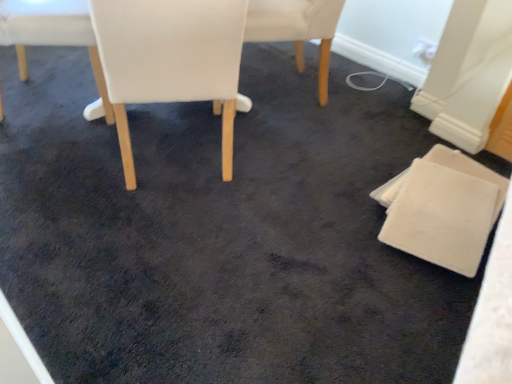
Question: Considering the relative sizes of white leather chair at center, marked as the 2th chair in a right-to-left arrangement, and white leather chair at center, the 2th chair viewed from the left, in the image provided, is white leather chair at center, marked as the 2th chair in a right-to-left arrangement, smaller than white leather chair at center, the 2th chair viewed from the left,?

Choices:
 (A) yes
 (B) no

Answer: (A)

Question: Is white leather chair at center, marked as the 2th chair in a right-to-left arrangement, surrounding white leather chair at center, the 2th chair viewed from the left?

Choices:
 (A) yes
 (B) no

Answer: (B)

Question: Is white leather chair at center, marked as the 2th chair in a right-to-left arrangement, at the right side of white leather chair at center, the 2th chair viewed from the left?

Choices:
 (A) no
 (B) yes

Answer: (B)

Question: Considering the relative sizes of white leather chair at center, marked as the 2th chair in a right-to-left arrangement, and white leather chair at center, the 2th chair viewed from the left, in the image provided, is white leather chair at center, marked as the 2th chair in a right-to-left arrangement, thinner than white leather chair at center, the 2th chair viewed from the left,?

Choices:
 (A) yes
 (B) no

Answer: (A)

Question: Does white leather chair at center, the third chair viewed from the left, come in front of white leather chair at center, the 2th chair viewed from the left?

Choices:
 (A) yes
 (B) no

Answer: (B)

Question: Which is correct: white leather chair at center, the 2th chair viewed from the left, is inside white felt coaster at lower right, placed as the 1th chair when sorted from right to left, or outside of it?

Choices:
 (A) outside
 (B) inside

Answer: (A)

Question: From a real-world perspective, is white leather chair at center, the 2th chair viewed from the left, physically located above or below white felt coaster at lower right, which appears as the fourth chair when viewed from the left?

Choices:
 (A) above
 (B) below

Answer: (A)

Question: Visually, is white leather chair at center, arranged as the third chair when viewed from the right, positioned to the left or to the right of white felt coaster at lower right, placed as the 1th chair when sorted from right to left?

Choices:
 (A) left
 (B) right

Answer: (A)

Question: Looking at their shapes, would you say white leather chair at center, arranged as the third chair when viewed from the right, is wider or thinner than white felt coaster at lower right, which appears as the fourth chair when viewed from the left?

Choices:
 (A) thin
 (B) wide

Answer: (B)

Question: From a real-world perspective, is white fabric chair at upper left, acting as the 4th chair starting from the right, positioned above or below white leather chair at center, the 2th chair viewed from the left?

Choices:
 (A) below
 (B) above

Answer: (A)

Question: Is point (23, 1) positioned closer to the camera than point (236, 59)?

Choices:
 (A) farther
 (B) closer

Answer: (A)

Question: From the image's perspective, relative to white leather chair at center, arranged as the third chair when viewed from the right, is white fabric chair at upper left, acting as the 4th chair starting from the right, above or below?

Choices:
 (A) above
 (B) below

Answer: (A)

Question: Based on their sizes in the image, would you say white fabric chair at upper left, acting as the 4th chair starting from the right, is bigger or smaller than white leather chair at center, arranged as the third chair when viewed from the right?

Choices:
 (A) big
 (B) small

Answer: (B)

Question: Is white leather chair at center, marked as the 2th chair in a right-to-left arrangement, bigger or smaller than white felt coaster at lower right, which appears as the fourth chair when viewed from the left?

Choices:
 (A) small
 (B) big

Answer: (B)

Question: Looking at their shapes, would you say white leather chair at center, the third chair viewed from the left, is wider or thinner than white felt coaster at lower right, placed as the 1th chair when sorted from right to left?

Choices:
 (A) thin
 (B) wide

Answer: (B)